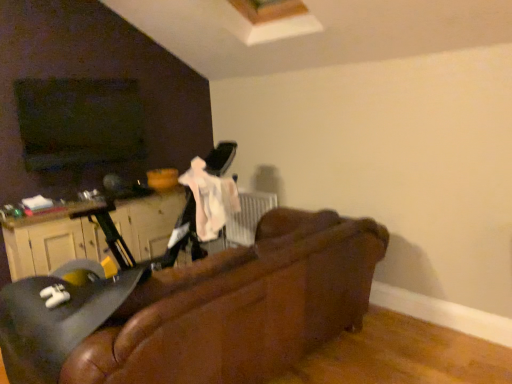
Question: In terms of width, does matte black swivel chair at left look wider or thinner when compared to wooden dresser at left?

Choices:
 (A) thin
 (B) wide

Answer: (B)

Question: Is point (62, 279) closer or farther from the camera than point (178, 190)?

Choices:
 (A) closer
 (B) farther

Answer: (A)

Question: Estimate the real-world distances between objects in this image. Which object is closer to the leather couch at center?

Choices:
 (A) wooden dresser at left
 (B) matte black swivel chair at left

Answer: (B)

Question: Estimate the real-world distances between objects in this image. Which object is farther from the leather couch at center?

Choices:
 (A) wooden dresser at left
 (B) matte black swivel chair at left

Answer: (A)